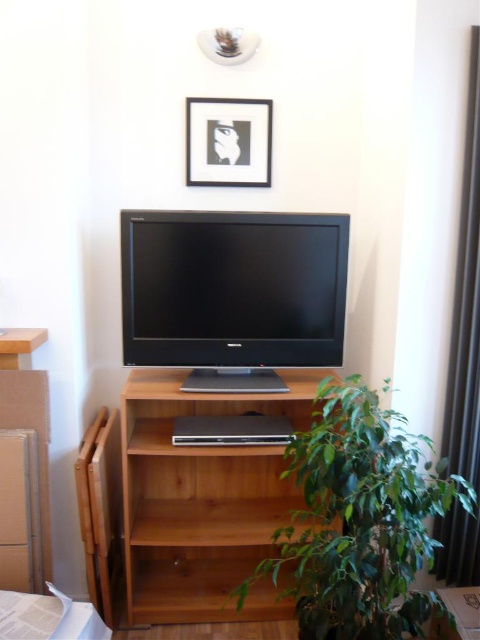
Who is lower down, light brown wood shelf at center or white paper at lower left?

Positioned lower is white paper at lower left.

Is light brown wood shelf at center wider than white paper at lower left?

Indeed, light brown wood shelf at center has a greater width compared to white paper at lower left.

Is point (205, 470) positioned behind point (73, 627)?

Yes, it is behind point (73, 627).

Where is `light brown wood shelf at center`? This screenshot has width=480, height=640. light brown wood shelf at center is located at coordinates (204, 500).

Is satin black flat screen tv at center to the right of wooden table at lower right from the viewer's perspective?

Incorrect, satin black flat screen tv at center is not on the right side of wooden table at lower right.

Is point (250, 266) farther from viewer compared to point (441, 625)?

Yes, point (250, 266) is behind point (441, 625).

Where is `satin black flat screen tv at center`? satin black flat screen tv at center is located at coordinates (232, 294).

Can you confirm if green leafy plant at lower right is thinner than white matte picture frame at upper center?

In fact, green leafy plant at lower right might be wider than white matte picture frame at upper center.

Locate an element on the screen. The height and width of the screenshot is (640, 480). green leafy plant at lower right is located at coordinates (360, 518).